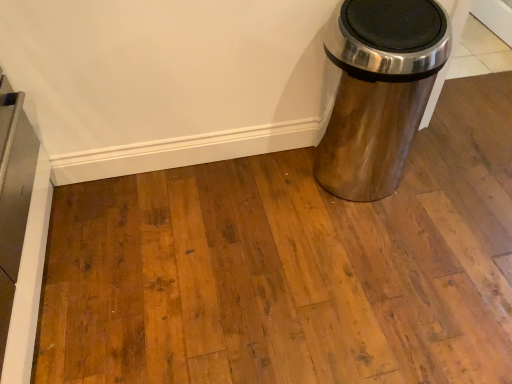
Measure the distance between polished stainless steel trash can at right and camera.

polished stainless steel trash can at right and camera are 4.05 feet apart.

Locate an element on the screen. The height and width of the screenshot is (384, 512). polished stainless steel trash can at right is located at coordinates (378, 91).

The image size is (512, 384). Describe the element at coordinates (378, 91) in the screenshot. I see `polished stainless steel trash can at right` at that location.

Where is `polished stainless steel trash can at right`? polished stainless steel trash can at right is located at coordinates (378, 91).